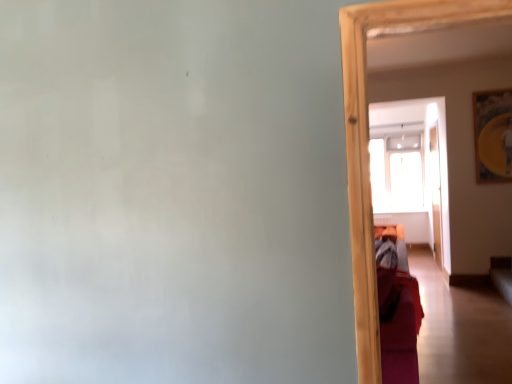
This screenshot has width=512, height=384. I want to click on wooden picture frame at upper right, so click(x=493, y=135).

Image resolution: width=512 pixels, height=384 pixels. Describe the element at coordinates (493, 135) in the screenshot. I see `wooden picture frame at upper right` at that location.

Where is `wooden picture frame at upper right`? This screenshot has width=512, height=384. wooden picture frame at upper right is located at coordinates (493, 135).